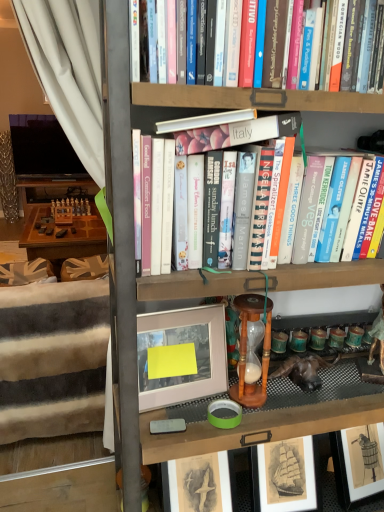
Find the location of a particular element. The width and height of the screenshot is (384, 512). wooden hourglass at center is located at coordinates (246, 349).

Describe the element at coordinates (246, 349) in the screenshot. This screenshot has width=384, height=512. I see `wooden hourglass at center` at that location.

What are the coordinates of `white fabric bed frame at left` in the screenshot? It's located at (53, 359).

This screenshot has width=384, height=512. Describe the element at coordinates (338, 128) in the screenshot. I see `hardcover books at center` at that location.

In order to click on wooden hourglass at center in this screenshot , I will do `click(246, 349)`.

Between wooden bookcase at center and matte white picture frame at center, which one appears on the right side from the viewer's perspective?

Positioned to the right is wooden bookcase at center.

Considering the sizes of objects wooden bookcase at center and matte white picture frame at center in the image provided, who is bigger, wooden bookcase at center or matte white picture frame at center?

wooden bookcase at center is bigger.

Which of these two, wooden bookcase at center or matte white picture frame at center, is thinner?

With smaller width is matte white picture frame at center.

Where is `bed frame below the matte white picture frame at center (from the image's perspective)`? bed frame below the matte white picture frame at center (from the image's perspective) is located at coordinates (53, 359).

Are matte white picture frame at center and white fabric bed frame at left making contact?

They are not placed beside each other.

Is matte white picture frame at center facing towards white fabric bed frame at left?

No, matte white picture frame at center is not facing towards white fabric bed frame at left.

Would you say hardcover books at center is a long distance from wooden bookcase at center?

No, there isn't a large distance between hardcover books at center and wooden bookcase at center.

Would you say hardcover books at center is inside or outside wooden bookcase at center?

hardcover books at center is contained in wooden bookcase at center.

Considering the relative sizes of hardcover books at center and wooden bookcase at center in the image provided, is hardcover books at center wider than wooden bookcase at center?

In fact, hardcover books at center might be narrower than wooden bookcase at center.

Between hardcover books at center and wooden bookcase at center, which one appears on the left side from the viewer's perspective?

hardcover books at center.

Is hardcover books at center surrounding white fabric bed frame at left?

Actually, white fabric bed frame at left is outside hardcover books at center.

This screenshot has width=384, height=512. Find the location of `book located above the white fabric bed frame at left (from a real-world perspective)`. book located above the white fabric bed frame at left (from a real-world perspective) is located at coordinates (338, 128).

From a real-world perspective, which object stands above the other?

In real-world perspective, hardcover books at center is above.

Is wooden hourglass at center taller than white fabric bed frame at left?

In fact, wooden hourglass at center may be shorter than white fabric bed frame at left.

Can you tell me how much wooden hourglass at center and white fabric bed frame at left differ in facing direction?

The angular difference between wooden hourglass at center and white fabric bed frame at left is 178 degrees.

Considering the positions of point (250, 320) and point (19, 355), is point (250, 320) closer or farther from the camera than point (19, 355)?

Point (250, 320).

Can you confirm if wooden hourglass at center is bigger than white fabric bed frame at left?

No.

Looking at their sizes, would you say matte white picture frame at center is wider or thinner than hardcover books at center?

Considering their sizes, matte white picture frame at center looks slimmer than hardcover books at center.

Identify the location of picture frame behind the hardcover books at center. (181, 355).

Which is nearer, (x=214, y=389) or (x=359, y=133)?

Point (x=214, y=389) is closer to the camera than point (x=359, y=133).

Is there a large distance between matte white picture frame at center and hardcover books at center?

They are positioned close to each other.

Does white fabric bed frame at left appear on the right side of hardcover books at center?

No.

From the image's perspective, is white fabric bed frame at left located beneath hardcover books at center?

Indeed, from the image's perspective, white fabric bed frame at left is shown beneath hardcover books at center.

Is white fabric bed frame at left wider or thinner than hardcover books at center?

Clearly, white fabric bed frame at left has more width compared to hardcover books at center.

Consider the image. From a real-world perspective, is white fabric bed frame at left positioned above or below hardcover books at center?

white fabric bed frame at left is below hardcover books at center.

Image resolution: width=384 pixels, height=512 pixels. What are the coordinates of `picture frame above the wooden bookcase at center (from a real-world perspective)` in the screenshot? It's located at (181, 355).

This screenshot has height=512, width=384. Find the location of `picture frame above the white fabric bed frame at left (from the image's perspective)`. picture frame above the white fabric bed frame at left (from the image's perspective) is located at coordinates click(181, 355).

Based on their spatial positions, is wooden bookcase at center or hardcover books at center further from white fabric bed frame at left?

hardcover books at center.

When comparing their distances from matte white picture frame at center, does wooden bookcase at center or white fabric bed frame at left seem closer?

Based on the image, wooden bookcase at center appears to be nearer to matte white picture frame at center.

Estimate the real-world distances between objects in this image. Which object is closer to white fabric bed frame at left, wooden hourglass at center or hardcover books at center?

wooden hourglass at center is positioned closer to the anchor white fabric bed frame at left.

Looking at the image, which one is located closer to wooden bookcase at center, white fabric bed frame at left or hardcover books at center?

hardcover books at center is closer to wooden bookcase at center.

From the picture: Based on their spatial positions, is hardcover books at center or wooden hourglass at center closer to white fabric bed frame at left?

wooden hourglass at center.

Based on their spatial positions, is matte white picture frame at center or hardcover books at center further from wooden bookcase at center?

Based on the image, hardcover books at center appears to be further to wooden bookcase at center.

Considering their positions, is hardcover books at center positioned closer to wooden bookcase at center than matte white picture frame at center?

matte white picture frame at center is closer to wooden bookcase at center.

From the image, which object appears to be farther from white fabric bed frame at left, hardcover books at center or matte white picture frame at center?

The object further to white fabric bed frame at left is hardcover books at center.

Identify the location of picture frame between white fabric bed frame at left and wooden hourglass at center in the horizontal direction. The width and height of the screenshot is (384, 512). (181, 355).

Where is `stool between hardcover books at center and matte white picture frame at center vertically`? stool between hardcover books at center and matte white picture frame at center vertically is located at coordinates (246, 349).

Identify the location of book between white fabric bed frame at left and wooden hourglass at center. (338, 128).

Image resolution: width=384 pixels, height=512 pixels. Identify the location of picture frame between wooden bookcase at center and wooden hourglass at center along the z-axis. click(181, 355).